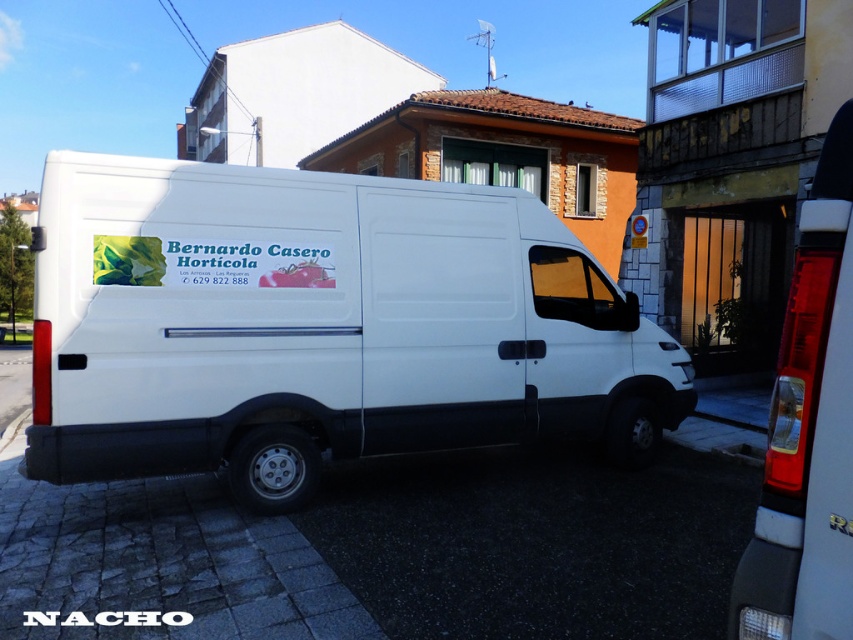
Question: Which point is closer to the camera taking this photo?

Choices:
 (A) (360, 278)
 (B) (784, 532)

Answer: (B)

Question: Which of the following is the closest to the observer?

Choices:
 (A) white concrete curb at lower right
 (B) white matte van at center

Answer: (A)

Question: Where is white matte van at center located in relation to white concrete curb at lower right in the image?

Choices:
 (A) right
 (B) left

Answer: (B)

Question: Which point is closer to the camera?

Choices:
 (A) white concrete curb at lower right
 (B) white matte van at center

Answer: (A)

Question: Where is white matte van at center located in relation to white concrete curb at lower right in the image?

Choices:
 (A) above
 (B) below

Answer: (A)

Question: Can you confirm if white matte van at center is positioned above white concrete curb at lower right?

Choices:
 (A) no
 (B) yes

Answer: (B)